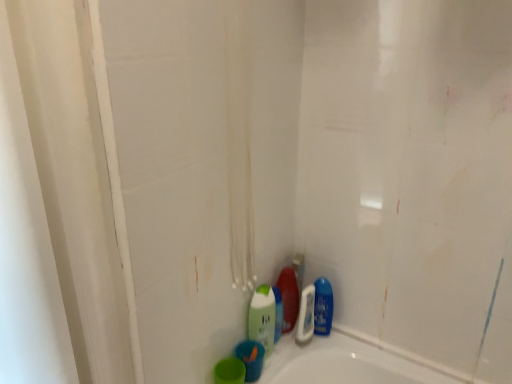
This screenshot has height=384, width=512. In order to click on green matte bottle at lower center, marked as the 3th cleaning product in a right-to-left arrangement in this screenshot , I will do `click(262, 317)`.

Find the location of a particular element. This screenshot has width=512, height=384. green matte cup at lower center, which appears as the 1th mouthwash when viewed from the front is located at coordinates (229, 371).

This screenshot has height=384, width=512. I want to click on blue glossy bottle at lower right, the 1th cleaning product viewed from the right, so click(x=306, y=316).

What do you see at coordinates (323, 306) in the screenshot? I see `blue glossy mouthwash at lower right, which is the 3th mouthwash from front to back` at bounding box center [323, 306].

Measure the distance between point [325,295] and camera.

They are 4.08 feet apart.

What is the approximate height of blue matte bottle at lower center, which is the second mouthwash from right to left?

blue matte bottle at lower center, which is the second mouthwash from right to left, is 3.39 inches in height.

Image resolution: width=512 pixels, height=384 pixels. I want to click on green matte bottle at lower center, marked as the 3th cleaning product in a right-to-left arrangement, so click(x=262, y=317).

Where is `cleaning product that is the 2nd one when counting upward from the green matte cup at lower center, the third mouthwash from the right (from the image's perspective)`? This screenshot has height=384, width=512. cleaning product that is the 2nd one when counting upward from the green matte cup at lower center, the third mouthwash from the right (from the image's perspective) is located at coordinates (262, 317).

From a real-world perspective, is green matte cup at lower center, marked as the first mouthwash in a left-to-right arrangement, under green matte bottle at lower center, acting as the 1th cleaning product starting from the left?

Yes, from a real-world perspective, green matte cup at lower center, marked as the first mouthwash in a left-to-right arrangement, is below green matte bottle at lower center, acting as the 1th cleaning product starting from the left.

How different are the orientations of green matte cup at lower center, which appears as the 1th mouthwash when viewed from the front, and green matte bottle at lower center, marked as the 3th cleaning product in a right-to-left arrangement, in degrees?

The facing directions of green matte cup at lower center, which appears as the 1th mouthwash when viewed from the front, and green matte bottle at lower center, marked as the 3th cleaning product in a right-to-left arrangement, are 7.96 degrees apart.

Could you measure the distance between shiny plastic bottle at lower center, the second cleaning product viewed from the right, and green matte cup at lower center, marked as the first mouthwash in a left-to-right arrangement?

shiny plastic bottle at lower center, the second cleaning product viewed from the right, and green matte cup at lower center, marked as the first mouthwash in a left-to-right arrangement, are 24.48 centimeters apart from each other.

Does shiny plastic bottle at lower center, which is the 2th cleaning product in left-to-right order, have a lesser width compared to green matte cup at lower center, which appears as the 1th mouthwash when viewed from the front?

Correct, the width of shiny plastic bottle at lower center, which is the 2th cleaning product in left-to-right order, is less than that of green matte cup at lower center, which appears as the 1th mouthwash when viewed from the front.

Is shiny plastic bottle at lower center, which is the 2th cleaning product in left-to-right order, oriented towards green matte cup at lower center, the third mouthwash from the right?

No, shiny plastic bottle at lower center, which is the 2th cleaning product in left-to-right order, is not facing towards green matte cup at lower center, the third mouthwash from the right.

From their relative heights in the image, would you say shiny plastic bottle at lower center, which is the 2th cleaning product in left-to-right order, is taller or shorter than green matte cup at lower center, which appears as the 1th mouthwash when viewed from the front?

Considering their sizes, shiny plastic bottle at lower center, which is the 2th cleaning product in left-to-right order, has more height than green matte cup at lower center, which appears as the 1th mouthwash when viewed from the front.

Can you see shiny plastic bottle at lower center, the second cleaning product viewed from the right, touching blue glossy mouthwash at lower right, arranged as the 3th mouthwash when viewed from the left?

Indeed, shiny plastic bottle at lower center, the second cleaning product viewed from the right, and blue glossy mouthwash at lower right, arranged as the 3th mouthwash when viewed from the left, are beside each other and touching.

Is shiny plastic bottle at lower center, which is the 2th cleaning product in left-to-right order, outside of blue glossy mouthwash at lower right, arranged as the 3th mouthwash when viewed from the left?

Absolutely, shiny plastic bottle at lower center, which is the 2th cleaning product in left-to-right order, is external to blue glossy mouthwash at lower right, arranged as the 3th mouthwash when viewed from the left.

Is shiny plastic bottle at lower center, which is the 2th cleaning product in left-to-right order, facing away from blue glossy mouthwash at lower right, the first mouthwash when ordered from right to left?

No, shiny plastic bottle at lower center, which is the 2th cleaning product in left-to-right order,'s orientation is not away from blue glossy mouthwash at lower right, the first mouthwash when ordered from right to left.

From the image's perspective, between shiny plastic bottle at lower center, the second cleaning product viewed from the right, and blue glossy mouthwash at lower right, which is the 3th mouthwash from front to back, which one is located above?

shiny plastic bottle at lower center, the second cleaning product viewed from the right.

Which of these two, green matte cup at lower center, marked as the first mouthwash in a left-to-right arrangement, or blue matte bottle at lower center, the second mouthwash from the left, stands shorter?

green matte cup at lower center, marked as the first mouthwash in a left-to-right arrangement, is shorter.

Is green matte cup at lower center, which is the 3th mouthwash in back-to-front order, at the left side of blue matte bottle at lower center, the 2th mouthwash when ordered from front to back?

Correct, you'll find green matte cup at lower center, which is the 3th mouthwash in back-to-front order, to the left of blue matte bottle at lower center, the 2th mouthwash when ordered from front to back.

From a real-world perspective, does green matte cup at lower center, marked as the first mouthwash in a left-to-right arrangement, sit lower than blue matte bottle at lower center, arranged as the 2th mouthwash when viewed from the back?

Yes, from a real-world perspective, green matte cup at lower center, marked as the first mouthwash in a left-to-right arrangement, is below blue matte bottle at lower center, arranged as the 2th mouthwash when viewed from the back.

Is green matte cup at lower center, which appears as the 1th mouthwash when viewed from the front, located outside blue matte bottle at lower center, arranged as the 2th mouthwash when viewed from the back?

Absolutely, green matte cup at lower center, which appears as the 1th mouthwash when viewed from the front, is external to blue matte bottle at lower center, arranged as the 2th mouthwash when viewed from the back.

Does blue glossy mouthwash at lower right, which is the 3th mouthwash from front to back, have a lesser height compared to blue glossy bottle at lower right, which appears as the third cleaning product when viewed from the left?

Indeed, blue glossy mouthwash at lower right, which is the 3th mouthwash from front to back, has a lesser height compared to blue glossy bottle at lower right, which appears as the third cleaning product when viewed from the left.

Which point is more distant from viewer, (x=324, y=302) or (x=298, y=328)?

The point (x=324, y=302) is more distant.

How different are the orientations of blue glossy mouthwash at lower right, the first mouthwash when ordered from right to left, and blue glossy bottle at lower right, which appears as the third cleaning product when viewed from the left, in degrees?

blue glossy mouthwash at lower right, the first mouthwash when ordered from right to left, and blue glossy bottle at lower right, which appears as the third cleaning product when viewed from the left, are facing 61.3 degrees away from each other.

Is blue glossy mouthwash at lower right, the first mouthwash when ordered from right to left, with blue glossy bottle at lower right, the 1th cleaning product viewed from the right?

Yes.

Who is taller, blue glossy mouthwash at lower right, arranged as the 3th mouthwash when viewed from the left, or blue matte bottle at lower center, the 2th mouthwash when ordered from front to back?

blue glossy mouthwash at lower right, arranged as the 3th mouthwash when viewed from the left.

From the image's perspective, is blue glossy mouthwash at lower right, the first mouthwash when ordered from right to left, above or below blue matte bottle at lower center, which is the second mouthwash from right to left?

Clearly, from the image's perspective, blue glossy mouthwash at lower right, the first mouthwash when ordered from right to left, is above blue matte bottle at lower center, which is the second mouthwash from right to left.

Is blue glossy mouthwash at lower right, acting as the 1th mouthwash starting from the back, facing towards blue matte bottle at lower center, the 2th mouthwash when ordered from front to back?

No, blue glossy mouthwash at lower right, acting as the 1th mouthwash starting from the back, is not aimed at blue matte bottle at lower center, the 2th mouthwash when ordered from front to back.

Is blue glossy bottle at lower right, which appears as the third cleaning product when viewed from the left, shorter than blue matte bottle at lower center, the 2th mouthwash when ordered from front to back?

Incorrect, the height of blue glossy bottle at lower right, which appears as the third cleaning product when viewed from the left, does not fall short of that of blue matte bottle at lower center, the 2th mouthwash when ordered from front to back.

Which object is positioned more to the left, blue glossy bottle at lower right, which appears as the third cleaning product when viewed from the left, or blue matte bottle at lower center, the second mouthwash from the left?

blue matte bottle at lower center, the second mouthwash from the left.

From the image's perspective, is blue glossy bottle at lower right, which appears as the third cleaning product when viewed from the left, on top of blue matte bottle at lower center, the second mouthwash from the left?

Yes, from the image's perspective, blue glossy bottle at lower right, which appears as the third cleaning product when viewed from the left, is over blue matte bottle at lower center, the second mouthwash from the left.

Is blue glossy bottle at lower right, the 1th cleaning product viewed from the right, not within blue matte bottle at lower center, arranged as the 2th mouthwash when viewed from the back?

Yes, blue glossy bottle at lower right, the 1th cleaning product viewed from the right, is not within blue matte bottle at lower center, arranged as the 2th mouthwash when viewed from the back.

From a real-world perspective, which mouthwash is the 3rd one underneath the green matte bottle at lower center, acting as the 1th cleaning product starting from the left? Please provide its 2D coordinates.

[(229, 371)]

Locate an element on the screen. The width and height of the screenshot is (512, 384). the 2nd mouthwash counting from the left of the shiny plastic bottle at lower center, the second cleaning product viewed from the right is located at coordinates (229, 371).

Looking at the image, which one is located closer to green matte cup at lower center, the third mouthwash from the right, shiny plastic bottle at lower center, the second cleaning product viewed from the right, or blue glossy bottle at lower right, the 1th cleaning product viewed from the right?

blue glossy bottle at lower right, the 1th cleaning product viewed from the right, is positioned closer to the anchor green matte cup at lower center, the third mouthwash from the right.

From the image, which object appears to be nearer to green matte bottle at lower center, acting as the 1th cleaning product starting from the left, blue matte bottle at lower center, the second mouthwash from the left, or blue glossy mouthwash at lower right, the first mouthwash when ordered from right to left?

blue matte bottle at lower center, the second mouthwash from the left, is closer to green matte bottle at lower center, acting as the 1th cleaning product starting from the left.

From the image, which object appears to be farther from green matte cup at lower center, marked as the first mouthwash in a left-to-right arrangement, blue matte bottle at lower center, which is the second mouthwash from right to left, or shiny plastic bottle at lower center, the second cleaning product viewed from the right?

shiny plastic bottle at lower center, the second cleaning product viewed from the right.

Estimate the real-world distances between objects in this image. Which object is closer to green matte bottle at lower center, acting as the 1th cleaning product starting from the left, blue glossy mouthwash at lower right, which is the 3th mouthwash from front to back, or green matte cup at lower center, which appears as the 1th mouthwash when viewed from the front?

Based on the image, green matte cup at lower center, which appears as the 1th mouthwash when viewed from the front, appears to be nearer to green matte bottle at lower center, acting as the 1th cleaning product starting from the left.

From the image, which object appears to be farther from blue matte bottle at lower center, arranged as the 2th mouthwash when viewed from the back, blue glossy bottle at lower right, which appears as the third cleaning product when viewed from the left, or green matte cup at lower center, which is the 3th mouthwash in back-to-front order?

The object further to blue matte bottle at lower center, arranged as the 2th mouthwash when viewed from the back, is blue glossy bottle at lower right, which appears as the third cleaning product when viewed from the left.

When comparing their distances from blue glossy bottle at lower right, the 1th cleaning product viewed from the right, does green matte bottle at lower center, marked as the 3th cleaning product in a right-to-left arrangement, or blue matte bottle at lower center, arranged as the 2th mouthwash when viewed from the back, seem further?

Based on the image, blue matte bottle at lower center, arranged as the 2th mouthwash when viewed from the back, appears to be further to blue glossy bottle at lower right, the 1th cleaning product viewed from the right.

When comparing their distances from blue glossy mouthwash at lower right, the first mouthwash when ordered from right to left, does blue glossy bottle at lower right, the 1th cleaning product viewed from the right, or green matte bottle at lower center, marked as the 3th cleaning product in a right-to-left arrangement, seem closer?

blue glossy bottle at lower right, the 1th cleaning product viewed from the right, is closer to blue glossy mouthwash at lower right, the first mouthwash when ordered from right to left.

Looking at the image, which one is located closer to blue glossy bottle at lower right, which appears as the third cleaning product when viewed from the left, blue matte bottle at lower center, the 2th mouthwash when ordered from front to back, or green matte bottle at lower center, acting as the 1th cleaning product starting from the left?

green matte bottle at lower center, acting as the 1th cleaning product starting from the left, lies closer to blue glossy bottle at lower right, which appears as the third cleaning product when viewed from the left, than the other object.

Where is `mouthwash located between green matte cup at lower center, which appears as the 1th mouthwash when viewed from the front, and shiny plastic bottle at lower center, which is the 2th cleaning product in left-to-right order, in the depth direction`? The width and height of the screenshot is (512, 384). mouthwash located between green matte cup at lower center, which appears as the 1th mouthwash when viewed from the front, and shiny plastic bottle at lower center, which is the 2th cleaning product in left-to-right order, in the depth direction is located at coordinates (251, 359).

The image size is (512, 384). Identify the location of mouthwash between green matte cup at lower center, which is the 3th mouthwash in back-to-front order, and blue glossy mouthwash at lower right, acting as the 1th mouthwash starting from the back, in the horizontal direction. (251, 359).

Locate an element on the screen. The width and height of the screenshot is (512, 384). cleaning product between green matte bottle at lower center, marked as the 3th cleaning product in a right-to-left arrangement, and blue glossy bottle at lower right, the 1th cleaning product viewed from the right is located at coordinates (x=291, y=291).

The height and width of the screenshot is (384, 512). Identify the location of mouthwash between green matte bottle at lower center, marked as the 3th cleaning product in a right-to-left arrangement, and green matte cup at lower center, the third mouthwash from the right, in the vertical direction. (251, 359).